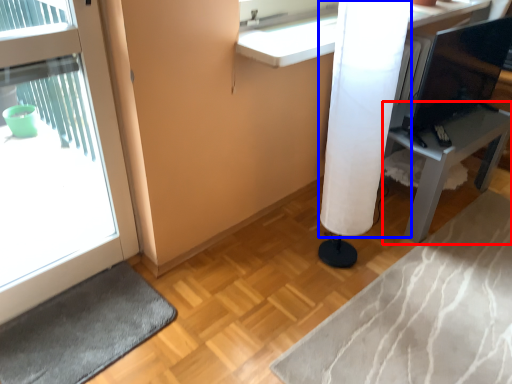
Question: Among these objects, which one is nearest to the camera, furniture (highlighted by a red box) or shower curtain (highlighted by a blue box)?

Choices:
 (A) furniture
 (B) shower curtain

Answer: (B)